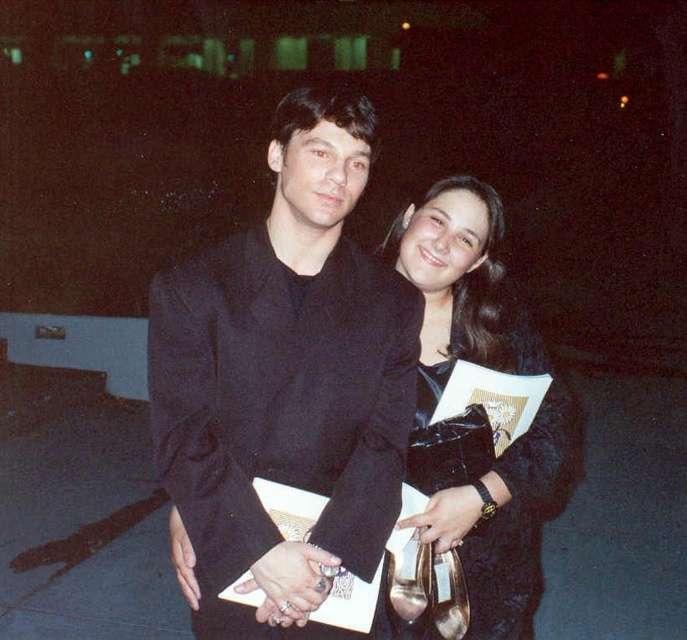
Question: Which object appears closest to the camera in this image?

Choices:
 (A) black matte suit at center
 (B) black satin clutch at center

Answer: (A)

Question: Can you confirm if black matte suit at center is positioned to the left of black satin clutch at center?

Choices:
 (A) yes
 (B) no

Answer: (A)

Question: Which of the following is the closest to the observer?

Choices:
 (A) (491, 577)
 (B) (221, 333)

Answer: (B)

Question: Can you confirm if black matte suit at center is positioned below black satin clutch at center?

Choices:
 (A) no
 (B) yes

Answer: (A)

Question: Where is black matte suit at center located in relation to black satin clutch at center in the image?

Choices:
 (A) below
 (B) above

Answer: (B)